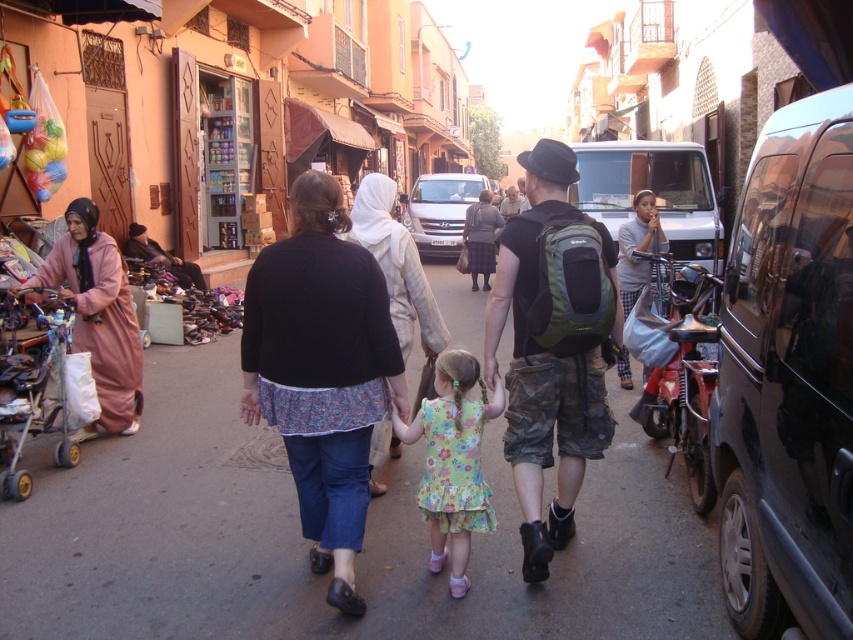
Question: Which point is farther to the camera?

Choices:
 (A) (320, 237)
 (B) (570, 472)
 (C) (99, 349)
 (D) (753, 317)

Answer: (C)

Question: Which point is farther from the camera taking this photo?

Choices:
 (A) (618, 365)
 (B) (544, 248)

Answer: (A)

Question: Among these objects, which one is farthest from the camera?

Choices:
 (A) floral fabric dress at center
 (B) dark brown leather jacket at center
 (C) floral cotton dress at center

Answer: (B)

Question: Does floral cotton dress at center lie behind silver metallic van at center?

Choices:
 (A) yes
 (B) no

Answer: (B)

Question: Can you confirm if black matte van at right is positioned to the left of light beige fabric headscarf at center?

Choices:
 (A) no
 (B) yes

Answer: (A)

Question: From the image, what is the correct spatial relationship of floral cotton dress at center in relation to floral fabric dress at center?

Choices:
 (A) above
 (B) below

Answer: (A)